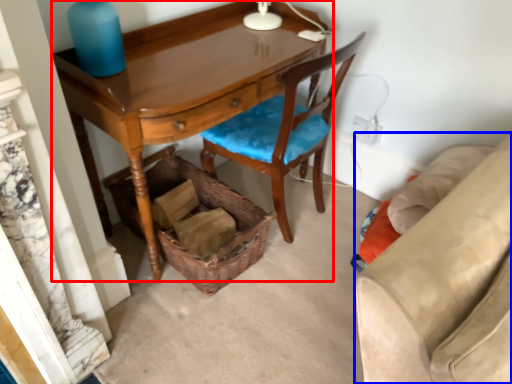
Question: Which of the following is the closest to the observer, desk (highlighted by a red box) or studio couch (highlighted by a blue box)?

Choices:
 (A) desk
 (B) studio couch

Answer: (A)